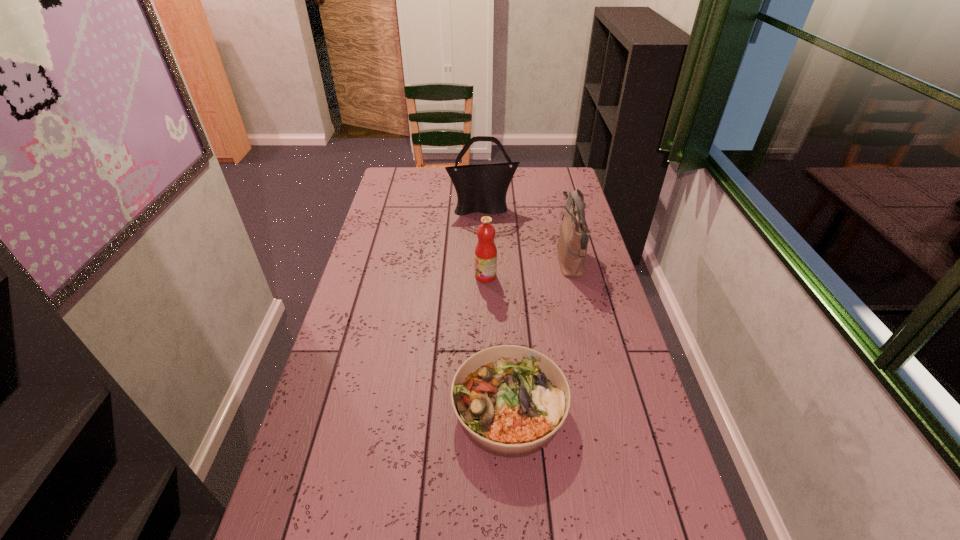
Where is `vacant space located on the front-facing side of the right shoulder bag`? vacant space located on the front-facing side of the right shoulder bag is located at coordinates 477,261.

Identify the location of blank space located on the front label of the second shortest object. (414, 276).

Find the location of a particular element. The image size is (960, 540). free location located 0.090m on the front label of the second shortest object is located at coordinates (449, 276).

The image size is (960, 540). In order to click on free spot located 0.210m on the front label of the second shortest object in this screenshot , I will do `click(417, 276)`.

Locate an element on the screen. free space located 0.280m on the left of the nearest object is located at coordinates (347, 409).

Image resolution: width=960 pixels, height=540 pixels. I want to click on object positioned at the right edge, so click(x=572, y=244).

In the image, there is a desktop. In order to click on blank space at the far edge in this screenshot , I will do `click(435, 185)`.

In the image, there is a desktop. At what (x,y) coordinates should I click in order to perform the action: click on vacant space at the left edge. Please return your answer as a coordinate pair (x, y). The width and height of the screenshot is (960, 540). Looking at the image, I should click on (368, 251).

The height and width of the screenshot is (540, 960). In the image, there is a desktop. Find the location of `free space at the right edge`. free space at the right edge is located at coordinates (672, 483).

The width and height of the screenshot is (960, 540). In order to click on vacant space at the far right corner in this screenshot , I will do `click(560, 171)`.